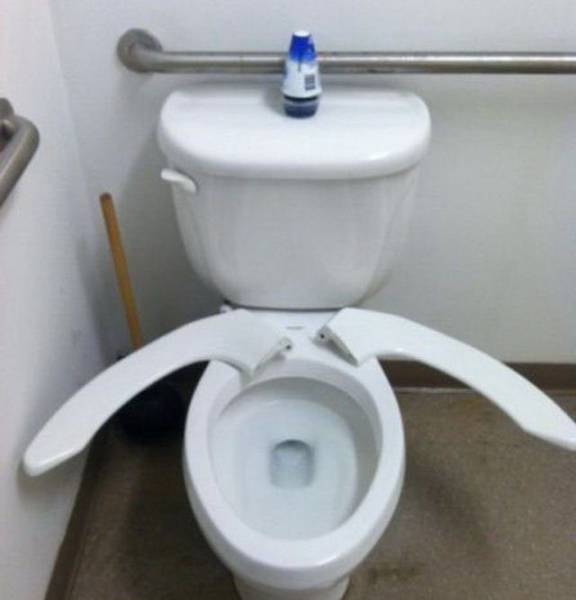
This screenshot has width=576, height=600. I want to click on toilet tank lid, so click(355, 142).